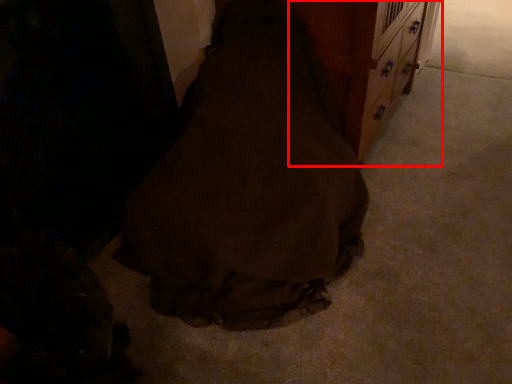
Question: Observing the image, what is the correct spatial positioning of dresser (annotated by the red box) in reference to fancy dress?

Choices:
 (A) right
 (B) left

Answer: (A)